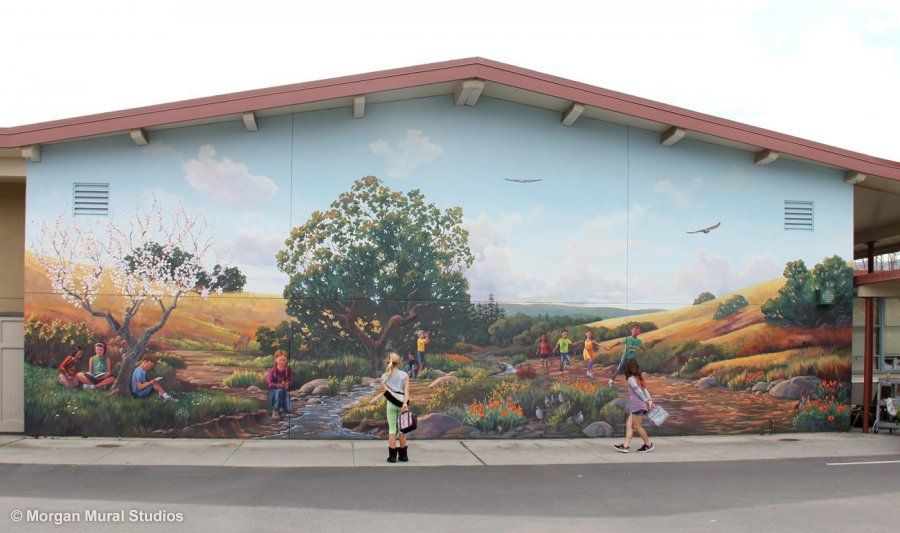
Find the location of `mural with no color`. mural with no color is located at coordinates (105, 516).